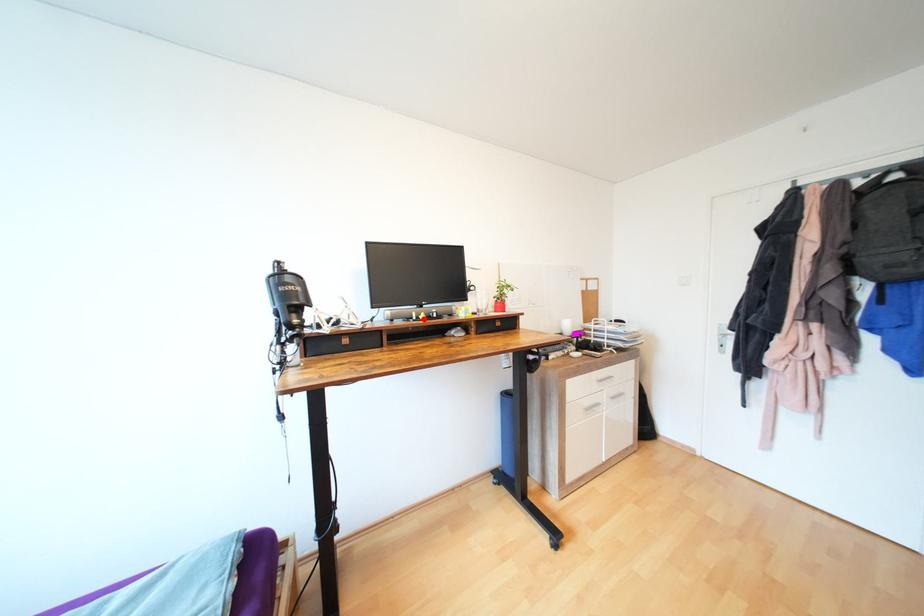
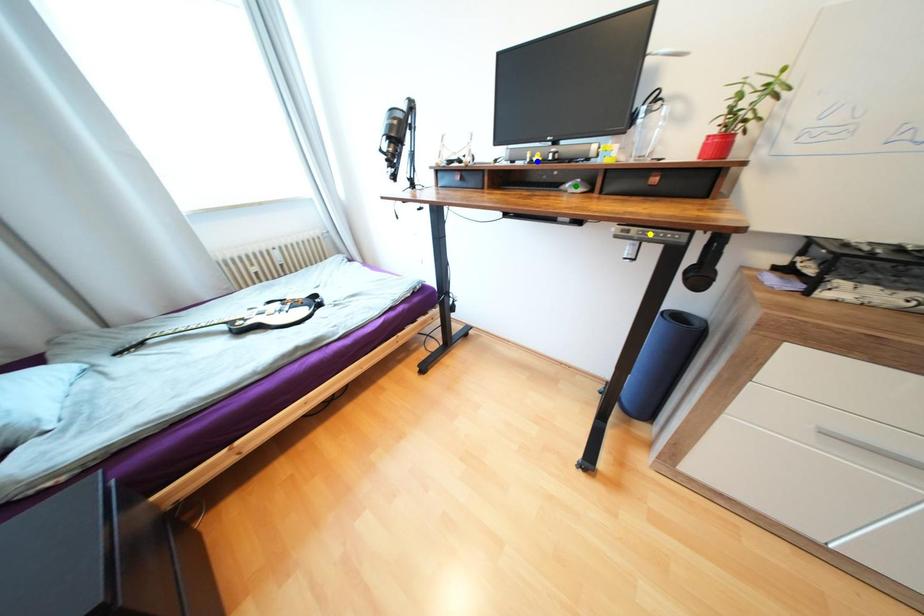
Question: I am providing you with two images of the same scene from different viewpoints. A red point is marked on the first image. You are given multiple points on the second image. Which mark in image 2 goes with the point in image 1?

Choices:
 (A) green point
 (B) yellow point
 (C) blue point

Answer: (C)